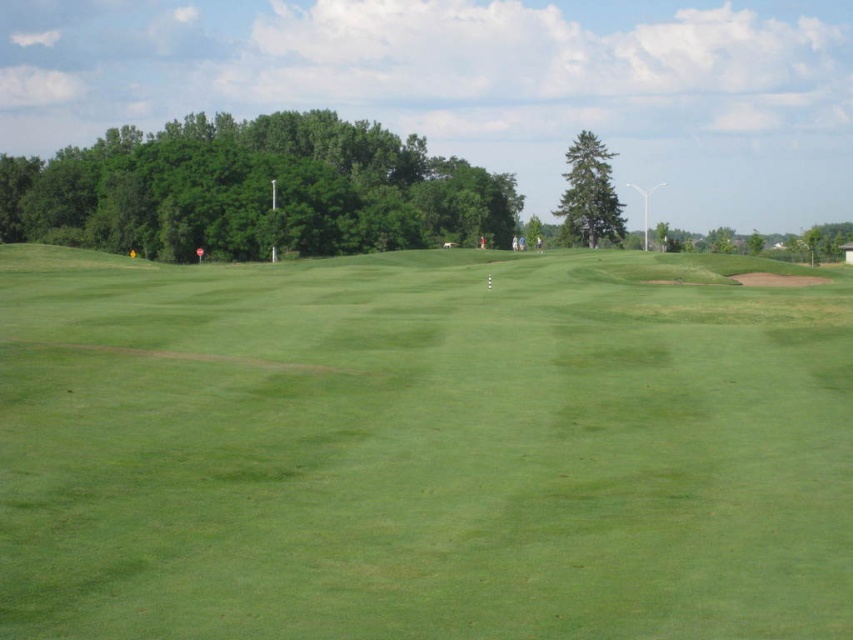
You are a golfer standing on the fairway and want to hit a ball towards the hole marked by the white flag. Which tree, the green leafy tree at upper left or the green textured tree at center, would you have to aim around first?

You would need to aim around the green leafy tree at upper left first because it is closer to the viewer and thus closer to your current position on the fairway compared to the green textured tree at center.

From the picture: You are a golfer standing on the green grassy field at center and want to hit the ball towards the green leafy tree at upper left. Which object takes up more space in the image?

The green leafy tree at upper left occupies more space in the image than the green grassy field at center.